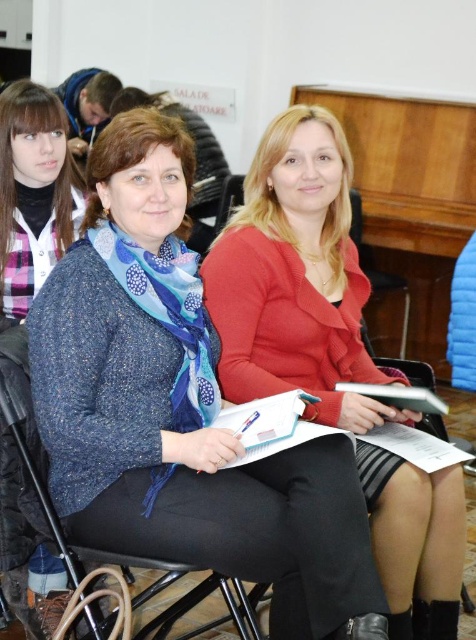
Is matte red sweater at center wider than black plastic chair at center?

Yes, matte red sweater at center is wider than black plastic chair at center.

Does matte red sweater at center appear under black plastic chair at center?

Incorrect, matte red sweater at center is not positioned below black plastic chair at center.

Which is in front, point (428, 636) or point (13, 372)?

Point (13, 372) is in front.

Identify the location of matte red sweater at center. The width and height of the screenshot is (476, 640). (296, 278).

Does blue textured scarf at center have a greater height compared to wooden at center?

Incorrect, blue textured scarf at center's height is not larger of wooden at center's.

Between blue textured scarf at center and wooden at center, which one is positioned lower?

wooden at center

Which is behind, point (11, 490) or point (399, 349)?

The point (399, 349) is more distant.

Image resolution: width=476 pixels, height=640 pixels. What are the coordinates of `blue textured scarf at center` in the screenshot? It's located at (33, 195).

Between matte red sweater at center and blue textured scarf at center, which one is positioned lower?

matte red sweater at center is lower down.

Between matte red sweater at center and blue textured scarf at center, which one appears on the left side from the viewer's perspective?

blue textured scarf at center

Which is behind, point (383, 451) or point (13, 196)?

The point (13, 196) is more distant.

This screenshot has height=640, width=476. In order to click on matte red sweater at center in this screenshot , I will do `click(296, 278)`.